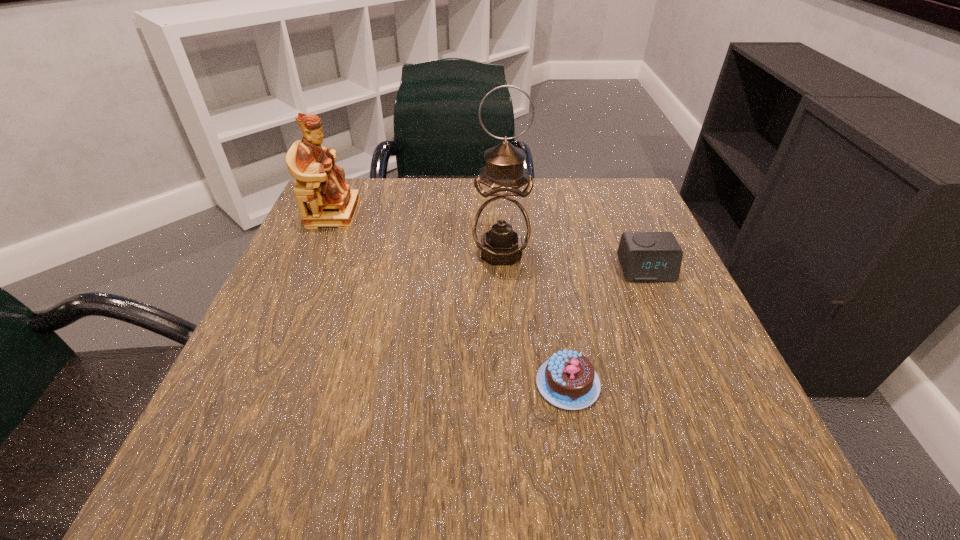
Find the location of a particular element. free location at the far right corner is located at coordinates (593, 197).

Identify the location of vacant space at the near right corner. The width and height of the screenshot is (960, 540). (728, 438).

Identify the location of vacant space that's between the oil lamp and the chocolate cake. (535, 318).

At what (x,y) coordinates should I click in order to perform the action: click on free space between the tallest object and the shortest object. Please return your answer as a coordinate pair (x, y). This screenshot has width=960, height=540. Looking at the image, I should click on (535, 318).

Where is `unoccupied area between the farthest object and the nearest object`? Image resolution: width=960 pixels, height=540 pixels. unoccupied area between the farthest object and the nearest object is located at coordinates (450, 298).

You are a GUI agent. You are given a task and a screenshot of the screen. Output one action in this format:
    pyautogui.click(x=<x>, y=<y>)
    Task: Click on the free space between the shortest object and the rightmost object
    Image resolution: width=960 pixels, height=540 pixels.
    Given the screenshot: What is the action you would take?
    pyautogui.click(x=607, y=327)

Image resolution: width=960 pixels, height=540 pixels. Identify the location of free space between the oil lamp and the third tallest object. (573, 261).

Where is `vacant area that lies between the oil lamp and the nearest object`? This screenshot has height=540, width=960. vacant area that lies between the oil lamp and the nearest object is located at coordinates (535, 318).

Locate an element on the screen. This screenshot has height=540, width=960. free space between the chocolate cake and the rightmost object is located at coordinates (607, 327).

The image size is (960, 540). I want to click on empty location between the shortest object and the third tallest object, so click(607, 327).